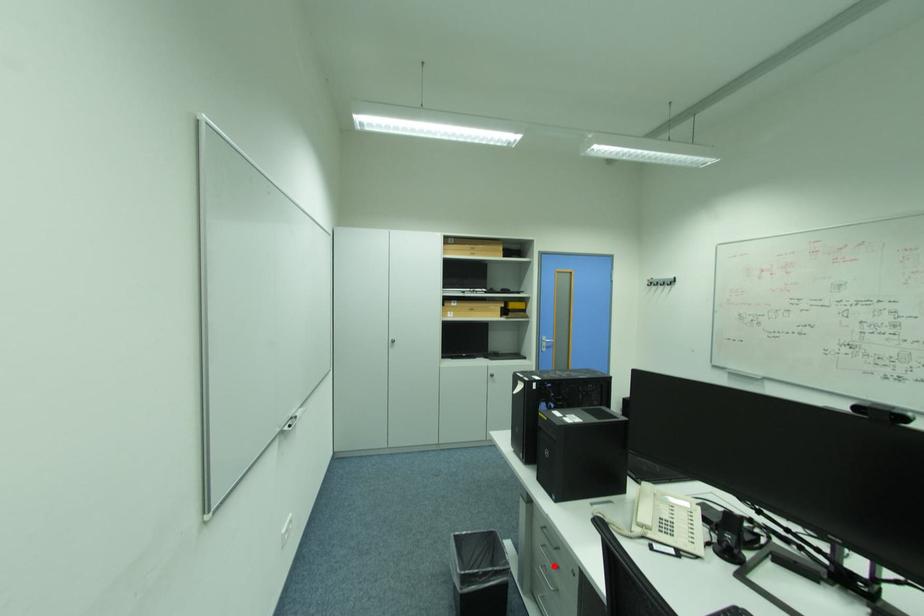
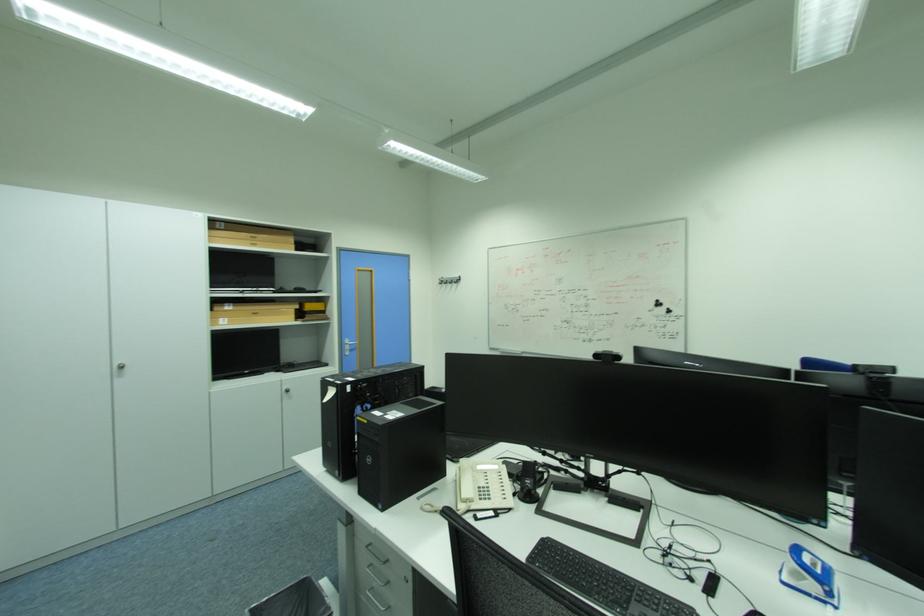
Question: I am providing you with two images of the same scene from different viewpoints. Given a red point in image1, look at the same physical point in image2. Is it:

Choices:
 (A) Closer to the viewpoint
 (B) Farther from the viewpoint

Answer: (A)